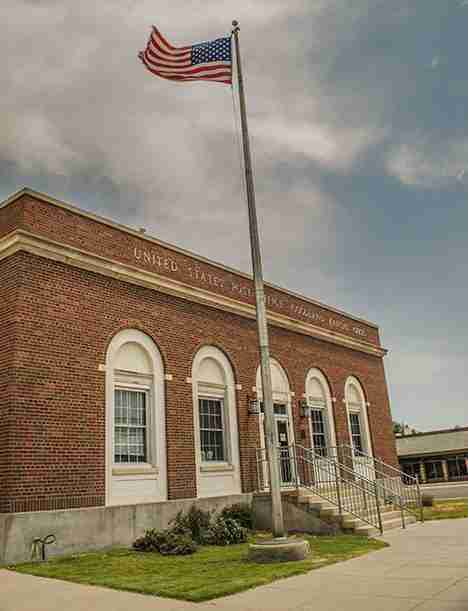
The width and height of the screenshot is (468, 611). In order to click on windowsill in this screenshot , I will do `click(138, 470)`, `click(213, 467)`, `click(364, 459)`, `click(324, 461)`.